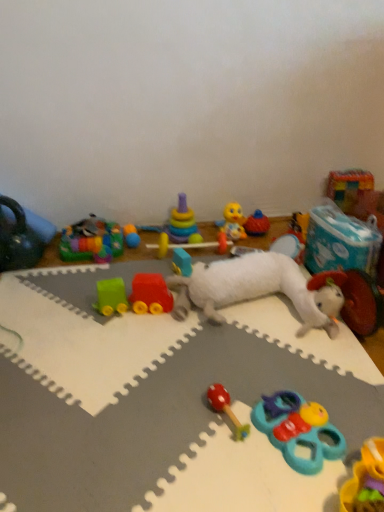
Locate an element on the screen. The height and width of the screenshot is (512, 384). vacant area that is in front of rubber ball at center, which appears as the 3th toy when viewed from the left is located at coordinates (133, 262).